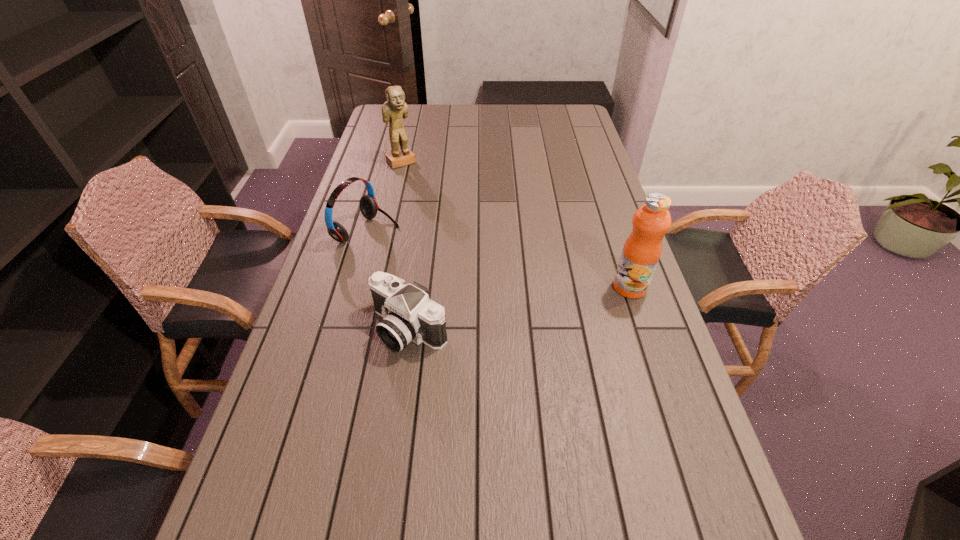
You are a GUI agent. You are given a task and a screenshot of the screen. Output one action in this format:
    pyautogui.click(x=<x>, y=<y>)
    Task: Click on the free space located on the front-facing side of the figurine
    This screenshot has height=540, width=960.
    Given the screenshot: What is the action you would take?
    pyautogui.click(x=434, y=196)

I want to click on free space located on the front-facing side of the figurine, so click(425, 186).

Locate an element on the screen. Image resolution: width=960 pixels, height=540 pixels. vacant space situated with the microphone attached to the side of the second shortest object is located at coordinates (409, 245).

Identify the location of vacant space located 0.320m with the microphone attached to the side of the second shortest object. The height and width of the screenshot is (540, 960). (484, 273).

I want to click on free space located 0.360m with the microphone attached to the side of the second shortest object, so click(x=496, y=278).

Where is `figurine that is at the left edge`? figurine that is at the left edge is located at coordinates (395, 108).

The image size is (960, 540). Find the location of `headset that is positioned at the left edge`. headset that is positioned at the left edge is located at coordinates (368, 205).

The image size is (960, 540). Identify the location of object situated at the right edge. (642, 250).

In the image, there is a desktop. Where is `vacant space at the far edge`? The width and height of the screenshot is (960, 540). vacant space at the far edge is located at coordinates (455, 105).

The width and height of the screenshot is (960, 540). I want to click on blank area at the left edge, so click(388, 214).